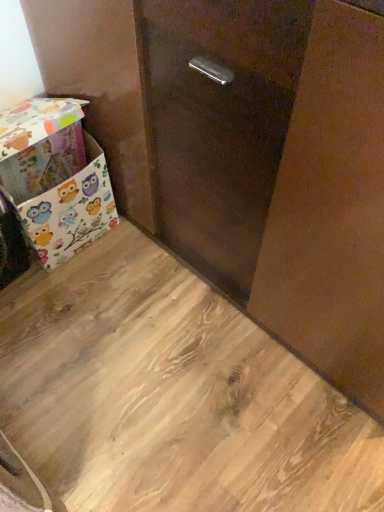
Question: Does owl-patterned fabric box at lower left have a lesser width compared to wooden floor at lower left?

Choices:
 (A) yes
 (B) no

Answer: (A)

Question: Does owl-patterned fabric box at lower left have a greater height compared to wooden floor at lower left?

Choices:
 (A) no
 (B) yes

Answer: (B)

Question: Is owl-patterned fabric box at lower left not close to wooden floor at lower left?

Choices:
 (A) yes
 (B) no

Answer: (B)

Question: Is owl-patterned fabric box at lower left to the left of wooden floor at lower left from the viewer's perspective?

Choices:
 (A) no
 (B) yes

Answer: (B)

Question: From the image's perspective, is owl-patterned fabric box at lower left below wooden floor at lower left?

Choices:
 (A) no
 (B) yes

Answer: (A)

Question: Can you confirm if owl-patterned fabric box at lower left is positioned to the right of wooden floor at lower left?

Choices:
 (A) no
 (B) yes

Answer: (A)

Question: From the image's perspective, is wooden floor at lower left above owl-patterned fabric box at lower left?

Choices:
 (A) yes
 (B) no

Answer: (B)

Question: Is wooden floor at lower left beside owl-patterned fabric box at lower left?

Choices:
 (A) no
 (B) yes

Answer: (A)

Question: From the image's perspective, does wooden floor at lower left appear lower than owl-patterned fabric box at lower left?

Choices:
 (A) yes
 (B) no

Answer: (A)

Question: From a real-world perspective, does wooden floor at lower left stand above owl-patterned fabric box at lower left?

Choices:
 (A) no
 (B) yes

Answer: (A)

Question: Is wooden floor at lower left positioned with its back to owl-patterned fabric box at lower left?

Choices:
 (A) yes
 (B) no

Answer: (B)

Question: Is wooden floor at lower left wider than owl-patterned fabric box at lower left?

Choices:
 (A) no
 (B) yes

Answer: (B)

Question: Do you think owl-patterned fabric box at lower left is within wooden floor at lower left, or outside of it?

Choices:
 (A) inside
 (B) outside

Answer: (B)